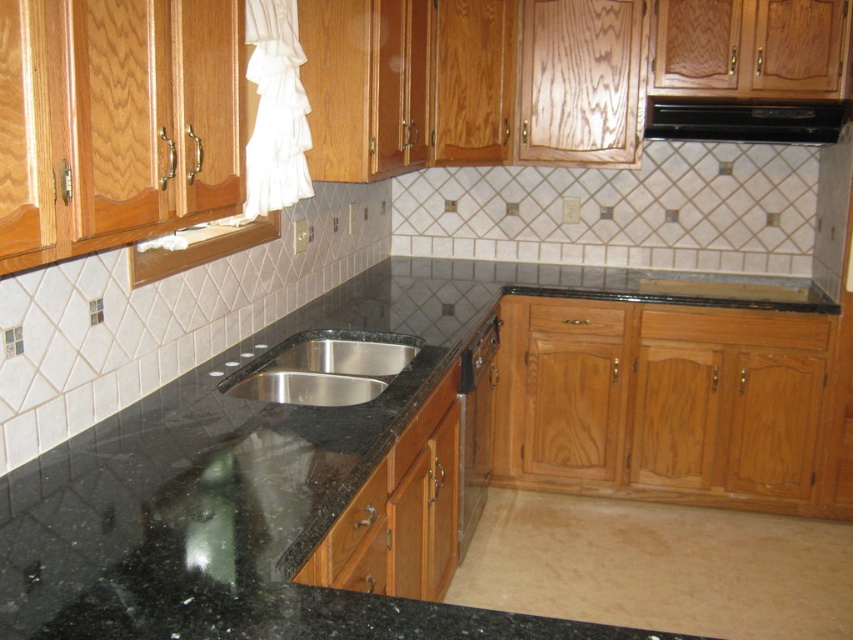
Is stainless steel sink at center bigger than wooden dishwasher at lower right?

Actually, stainless steel sink at center might be smaller than wooden dishwasher at lower right.

What do you see at coordinates (323, 369) in the screenshot? I see `stainless steel sink at center` at bounding box center [323, 369].

Is point (357, 355) more distant than point (492, 364)?

No, (357, 355) is in front of (492, 364).

Image resolution: width=853 pixels, height=640 pixels. What are the coordinates of `stainless steel sink at center` in the screenshot? It's located at (323, 369).

Between point (271, 509) and point (380, 339), which one is positioned behind?

The point (380, 339) is more distant.

In the scene shown: Between black granite countertop at center and stainless steel sink at center, which one appears on the right side from the viewer's perspective?

black granite countertop at center

Measure the distance between black granite countertop at center and camera.

The distance of black granite countertop at center from camera is 3.57 feet.

You are a GUI agent. You are given a task and a screenshot of the screen. Output one action in this format:
    pyautogui.click(x=<x>, y=<y>)
    Task: Click on the black granite countertop at center
    
    Given the screenshot: What is the action you would take?
    pyautogui.click(x=267, y=452)

The image size is (853, 640). I want to click on black granite countertop at center, so click(x=267, y=452).

Can you confirm if black granite countertop at center is shorter than wooden dishwasher at lower right?

Yes.

Does point (300, 412) lie in front of point (485, 348)?

Yes.

Find the location of a particular element. This screenshot has height=640, width=853. black granite countertop at center is located at coordinates (267, 452).